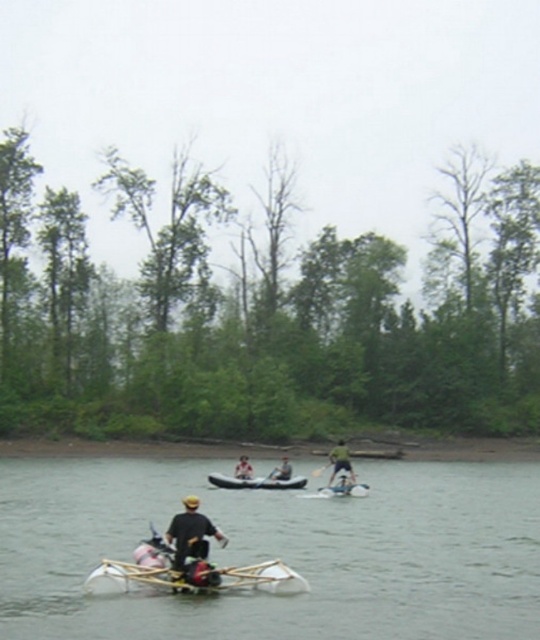
Between white plastic raft at lower center and white fabric kayak at center, which one appears on the right side from the viewer's perspective?

white fabric kayak at center is more to the right.

Between point (43, 568) and point (246, 458), which one is positioned behind?

Point (246, 458)

Find the location of a particular element. The width and height of the screenshot is (540, 640). white plastic raft at lower center is located at coordinates (278, 552).

Between matte black canoe at center and green fabric kayak at center, which one has more height?

green fabric kayak at center

Which is below, matte black canoe at center or green fabric kayak at center?

matte black canoe at center is below.

What are the coordinates of `matte black canoe at center` in the screenshot? It's located at (345, 490).

You are a GUI agent. You are given a task and a screenshot of the screen. Output one action in this format:
    pyautogui.click(x=<x>, y=<y>)
    Task: Click on the matte black canoe at center
    The image size is (540, 640).
    Given the screenshot: What is the action you would take?
    pyautogui.click(x=345, y=490)

Can you confirm if white fabric kayak at center is wider than green fabric kayak at center?

Yes.

The height and width of the screenshot is (640, 540). Identify the location of white fabric kayak at center. (244, 468).

Is point (239, 474) positioned in front of point (347, 481)?

That is False.

Locate an element on the screen. This screenshot has width=540, height=640. white fabric kayak at center is located at coordinates (244, 468).